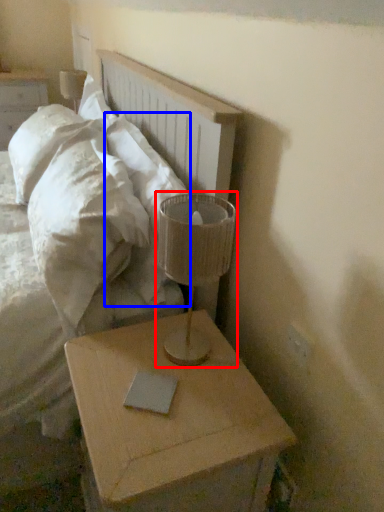
Question: Which object appears closest to the camera in this image, table lamp (highlighted by a red box) or pillow (highlighted by a blue box)?

Choices:
 (A) table lamp
 (B) pillow

Answer: (A)